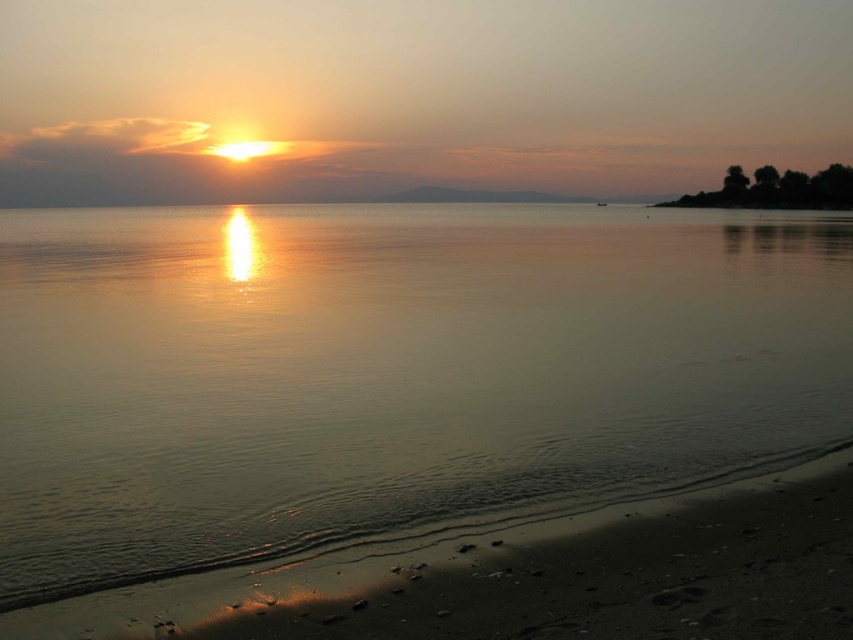
Question: Is smooth water at center bigger than sandy beach at lower right?

Choices:
 (A) no
 (B) yes

Answer: (B)

Question: Which point is farther to the camera?

Choices:
 (A) (769, 584)
 (B) (474, 376)

Answer: (B)

Question: Can you confirm if smooth water at center is thinner than sandy beach at lower right?

Choices:
 (A) yes
 (B) no

Answer: (B)

Question: Does smooth water at center have a greater width compared to sandy beach at lower right?

Choices:
 (A) no
 (B) yes

Answer: (B)